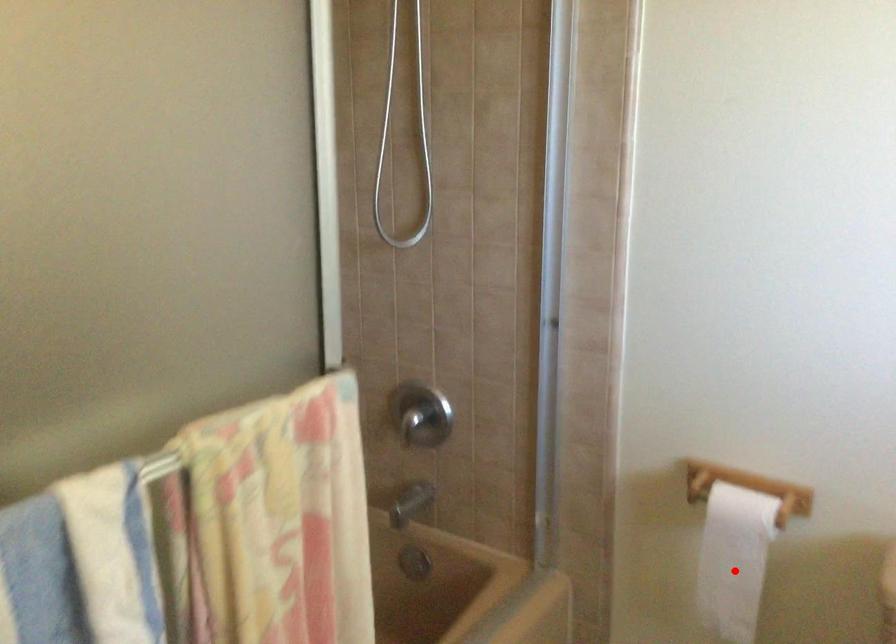
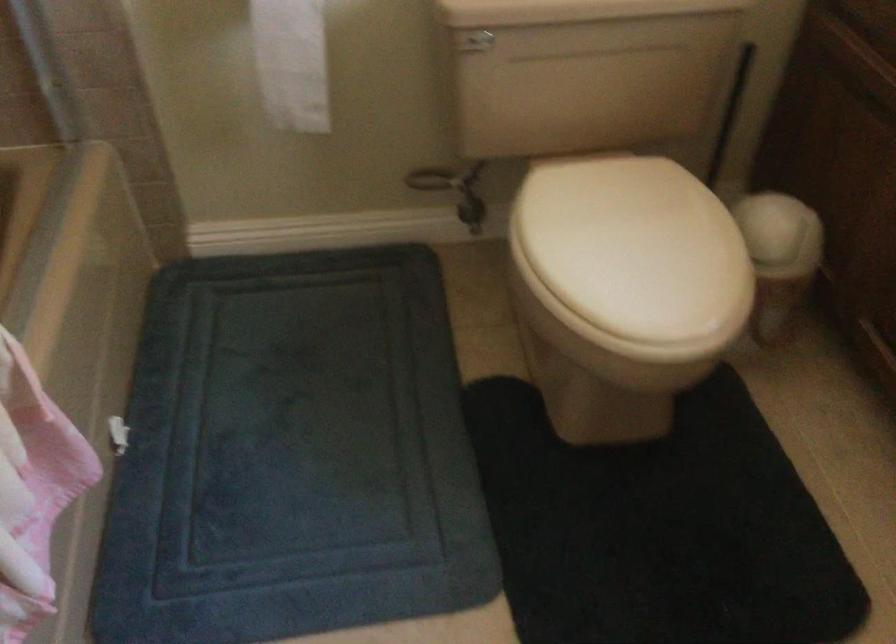
In the second image, find the point that corresponds to the highlighted location in the first image.

(291, 62)